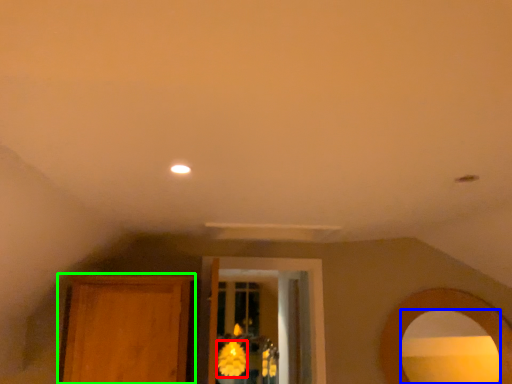
Question: Which object is the closest to the flower (highlighted by a red box)? Choose among these: mirror (highlighted by a blue box) or armoire (highlighted by a green box).

Choices:
 (A) mirror
 (B) armoire

Answer: (B)